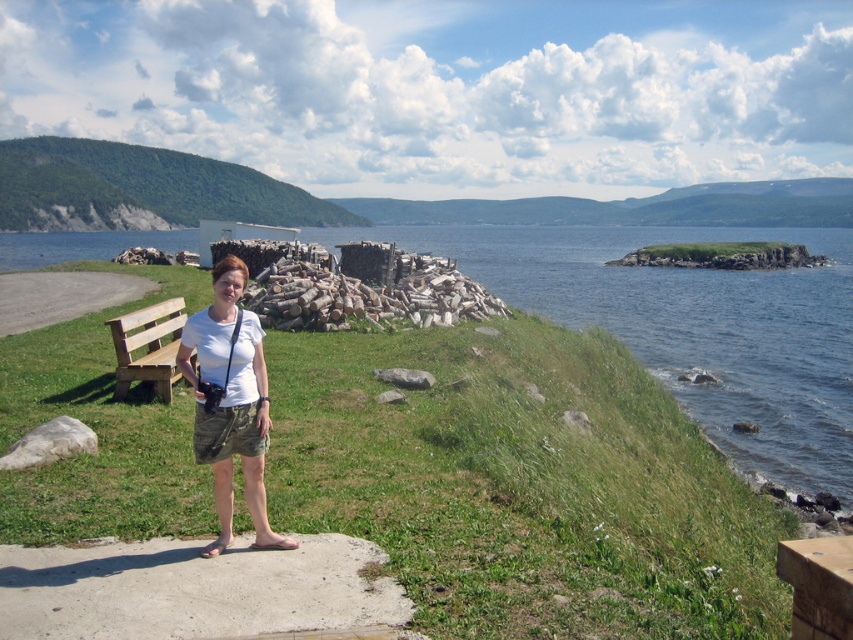
Which is below, green grassy at center or white cotton shirt at center?

green grassy at center is below.

Is point (57, 342) in front of point (213, 276)?

No, it is not.

Locate an element on the screen. This screenshot has width=853, height=640. green grassy at center is located at coordinates (521, 484).

Does point (219, 529) come closer to viewer compared to point (167, 328)?

Yes.

Is point (235, 390) behind point (183, 305)?

No, (235, 390) is closer to viewer.

Is point (235, 392) less distant than point (117, 348)?

Yes, point (235, 392) is closer to viewer.

Identify the location of white cotton shirt at center. The height and width of the screenshot is (640, 853). (230, 403).

This screenshot has height=640, width=853. I want to click on green leafy hillside at upper left, so click(x=142, y=189).

Can you confirm if green leafy hillside at upper left is positioned to the left of wooden bench at left?

Indeed, green leafy hillside at upper left is positioned on the left side of wooden bench at left.

At what (x,y) coordinates should I click in order to perform the action: click on green leafy hillside at upper left. Please return your answer as a coordinate pair (x, y). This screenshot has width=853, height=640. Looking at the image, I should click on (142, 189).